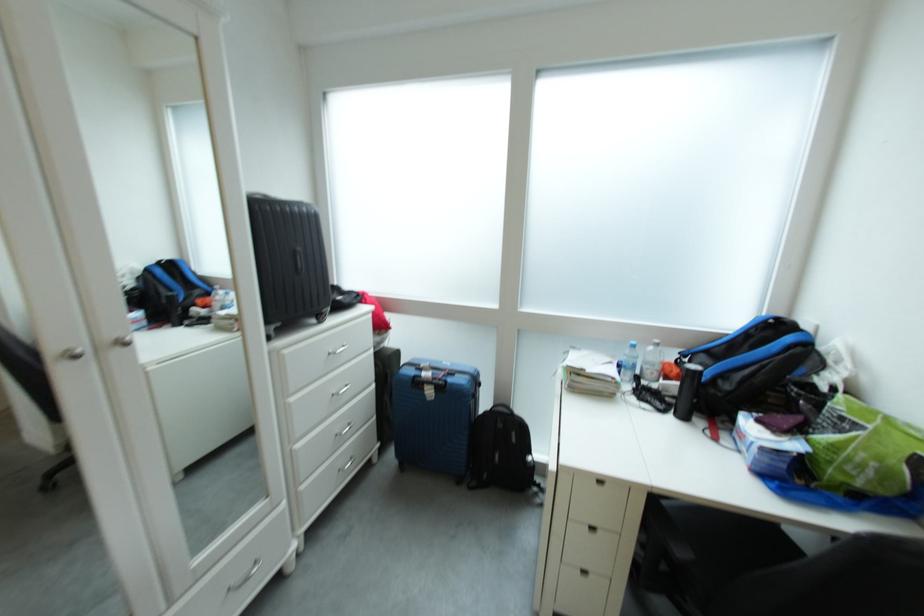
Find where to lift the black portable speaker. Please return your answer as a coordinate pair (x, y).

(287, 260)